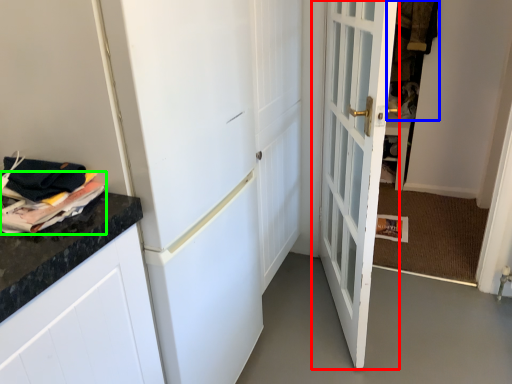
Question: Which is farther away from door (highlighted by a red box)? laundry (highlighted by a blue box) or magazine (highlighted by a green box)?

Choices:
 (A) laundry
 (B) magazine

Answer: (A)